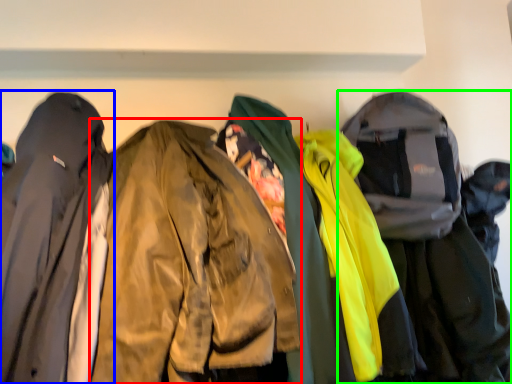
Question: Which is farther away from jacket (highlighted by a red box)? jacket (highlighted by a blue box) or jacket (highlighted by a green box)?

Choices:
 (A) jacket
 (B) jacket

Answer: (B)